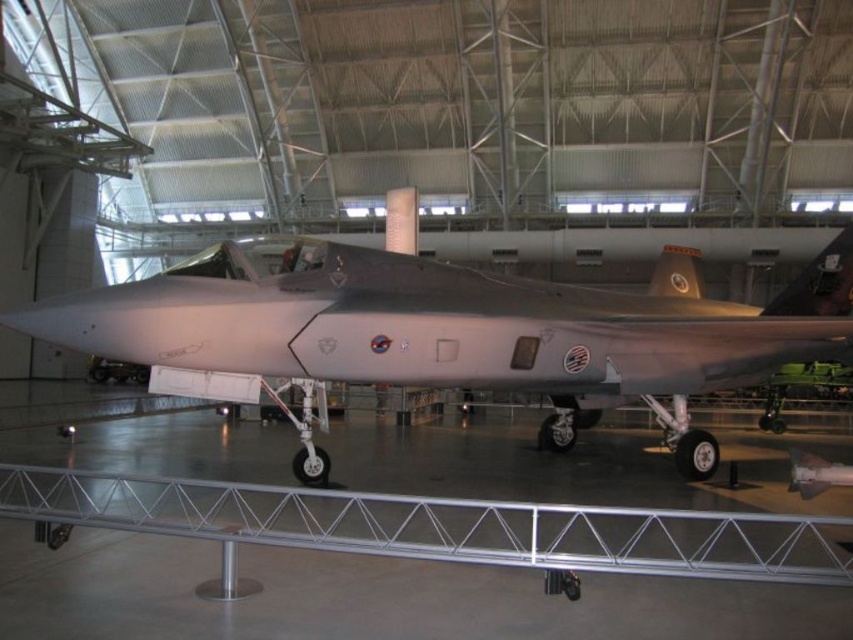
Question: Does matte gray airplane at center have a smaller size compared to silver/metallic rail at lower center?

Choices:
 (A) yes
 (B) no

Answer: (A)

Question: Which object appears closest to the camera in this image?

Choices:
 (A) matte gray airplane at center
 (B) silver/metallic rail at lower center

Answer: (B)

Question: In this image, where is matte gray airplane at center located relative to silver/metallic rail at lower center?

Choices:
 (A) left
 (B) right

Answer: (B)

Question: Can you confirm if matte gray airplane at center is positioned to the right of silver/metallic rail at lower center?

Choices:
 (A) no
 (B) yes

Answer: (B)